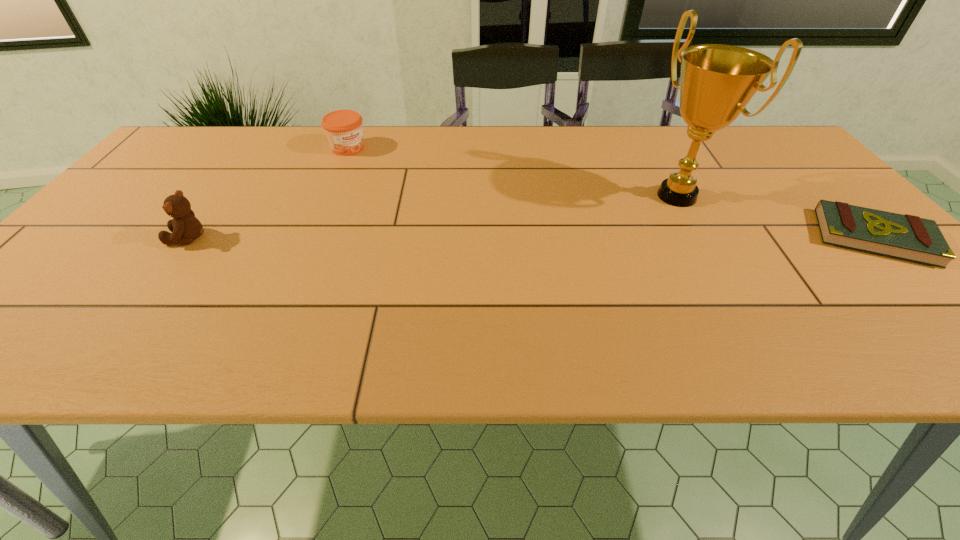
Where is `free spot located 0.380m on the front label of the third tallest object`? free spot located 0.380m on the front label of the third tallest object is located at coordinates (439, 218).

Locate an element on the screen. This screenshot has width=960, height=540. vacant space located on the front label of the third tallest object is located at coordinates (431, 212).

Find the location of a particular element. object present at the far edge is located at coordinates (343, 128).

The height and width of the screenshot is (540, 960). In the image, there is a desktop. What are the coordinates of `vacant space at the far edge` in the screenshot? It's located at (645, 126).

At what (x,y) coordinates should I click in order to perform the action: click on free space at the near edge of the desktop. Please return your answer as a coordinate pair (x, y). Image resolution: width=960 pixels, height=540 pixels. Looking at the image, I should click on (528, 307).

This screenshot has height=540, width=960. In the image, there is a desktop. What are the coordinates of `blank space at the left edge` in the screenshot? It's located at (114, 274).

Locate an element on the screen. This screenshot has width=960, height=540. vacant area at the far left corner is located at coordinates (178, 155).

Where is `blank space at the far right corner of the desktop`? This screenshot has width=960, height=540. blank space at the far right corner of the desktop is located at coordinates (776, 160).

This screenshot has width=960, height=540. Identify the location of free space between the teddy bear and the tallest object. (433, 217).

The width and height of the screenshot is (960, 540). I want to click on free space between the third tallest object and the tallest object, so click(513, 172).